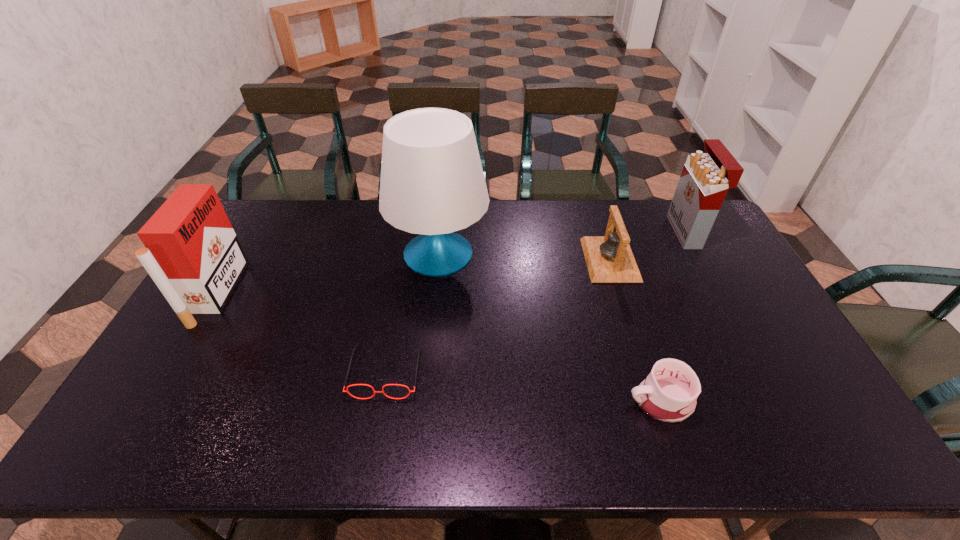
What are the coordinates of `object that is the fifth closest one to the nearer cigarette case` in the screenshot? It's located at (706, 177).

Identify which object is the third closest to the tallest object. Please provide its 2D coordinates. Your answer should be formatted as a tuple, i.e. [(x, y)], where the tuple contains the x and y coordinates of a point satisfying the conditions above.

[(193, 255)]

The width and height of the screenshot is (960, 540). Identify the location of free location that satisfies the following two spatial constraints: 1. with the lid open on the right cigarette case; 2. on the front-facing side of the spectacles. (762, 371).

Locate an element on the screen. free spot that satisfies the following two spatial constraints: 1. on the front-facing side of the bell; 2. on the right side of the tallest object is located at coordinates (438, 260).

At what (x,y) coordinates should I click in order to perform the action: click on free region that satisfies the following two spatial constraints: 1. with the lid open on the rightmost object; 2. on the front-facing side of the spectacles. Please return your answer as a coordinate pair (x, y). Looking at the image, I should click on click(762, 371).